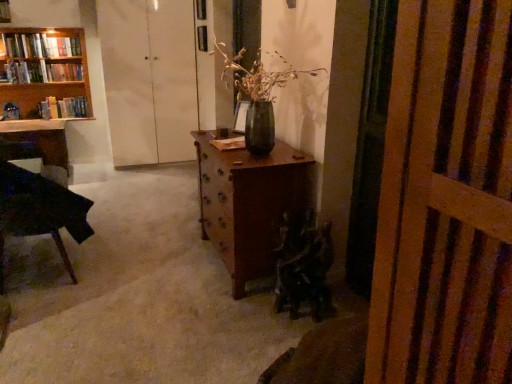
Question: Is matte dark green vase at center next to hardcover book at left, which appears as the 4th book when viewed from the top?

Choices:
 (A) no
 (B) yes

Answer: (A)

Question: Considering the relative sizes of matte dark green vase at center and hardcover book at left, acting as the 1th book starting from the bottom, in the image provided, is matte dark green vase at center shorter than hardcover book at left, acting as the 1th book starting from the bottom,?

Choices:
 (A) yes
 (B) no

Answer: (B)

Question: Is matte dark green vase at center positioned with its back to hardcover book at left, which appears as the 4th book when viewed from the top?

Choices:
 (A) yes
 (B) no

Answer: (B)

Question: Is matte dark green vase at center smaller than hardcover book at left, which appears as the 4th book when viewed from the top?

Choices:
 (A) yes
 (B) no

Answer: (B)

Question: Is matte dark green vase at center not close to hardcover book at left, which appears as the 4th book when viewed from the top?

Choices:
 (A) no
 (B) yes

Answer: (B)

Question: Does matte dark green vase at center come in front of hardcover book at left, which appears as the 4th book when viewed from the top?

Choices:
 (A) yes
 (B) no

Answer: (A)

Question: Is dark green fabric armchair at lower center to the left of hardcover book at upper left, the third book in the bottom-to-top sequence, from the viewer's perspective?

Choices:
 (A) yes
 (B) no

Answer: (B)

Question: From the image's perspective, does dark green fabric armchair at lower center appear lower than hardcover book at upper left, the third book in the bottom-to-top sequence?

Choices:
 (A) no
 (B) yes

Answer: (B)

Question: Could you tell me if dark green fabric armchair at lower center is turned towards hardcover book at upper left, the third book in the bottom-to-top sequence?

Choices:
 (A) no
 (B) yes

Answer: (A)

Question: Can you confirm if dark green fabric armchair at lower center is positioned to the right of hardcover book at upper left, the third book in the bottom-to-top sequence?

Choices:
 (A) yes
 (B) no

Answer: (A)

Question: Can you confirm if dark green fabric armchair at lower center is wider than hardcover book at upper left, which is counted as the 2th book, starting from the top?

Choices:
 (A) yes
 (B) no

Answer: (A)

Question: Is dark green fabric armchair at lower center not near hardcover book at upper left, which is counted as the 2th book, starting from the top?

Choices:
 (A) yes
 (B) no

Answer: (A)

Question: Is matte black desk at left not near wooden bookshelf at upper left, which is the 2th book in bottom-to-top order?

Choices:
 (A) no
 (B) yes

Answer: (A)